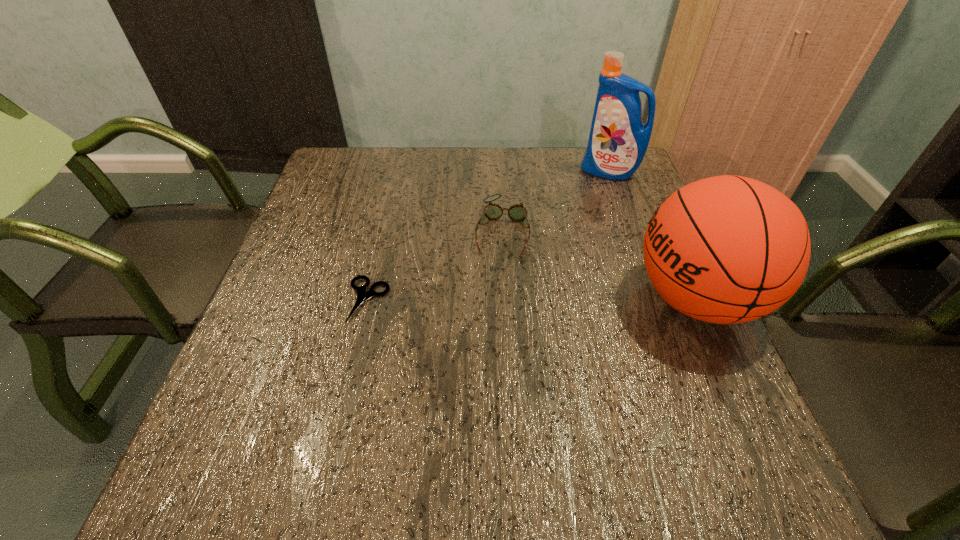
Where is `free space located on the label of the detergent`? free space located on the label of the detergent is located at coordinates (580, 197).

Locate an element on the screen. This screenshot has height=540, width=960. blank space located on the label of the detergent is located at coordinates (553, 226).

This screenshot has height=540, width=960. I want to click on free location located 0.310m on the label of the detergent, so click(x=541, y=239).

Locate an element on the screen. The image size is (960, 540). blank space located 0.240m on the front-facing side of the third tallest object is located at coordinates (488, 343).

You are a GUI agent. You are given a task and a screenshot of the screen. Output one action in this format:
    pyautogui.click(x=<x>, y=<y>)
    Task: Click on the free location located on the front-facing side of the third tallest object
    Image resolution: width=960 pixels, height=540 pixels.
    Given the screenshot: What is the action you would take?
    pyautogui.click(x=498, y=274)

Where is `vacant space located 0.060m on the front-facing side of the third tallest object`? vacant space located 0.060m on the front-facing side of the third tallest object is located at coordinates (497, 277).

Identify the location of object that is positioned at the far edge. (618, 140).

What are the coordinates of `basketball positioned at the right edge` in the screenshot? It's located at (728, 249).

Find the location of `detergent that is at the right edge`. detergent that is at the right edge is located at coordinates (618, 140).

This screenshot has width=960, height=540. In order to click on object at the far right corner in this screenshot , I will do `click(618, 140)`.